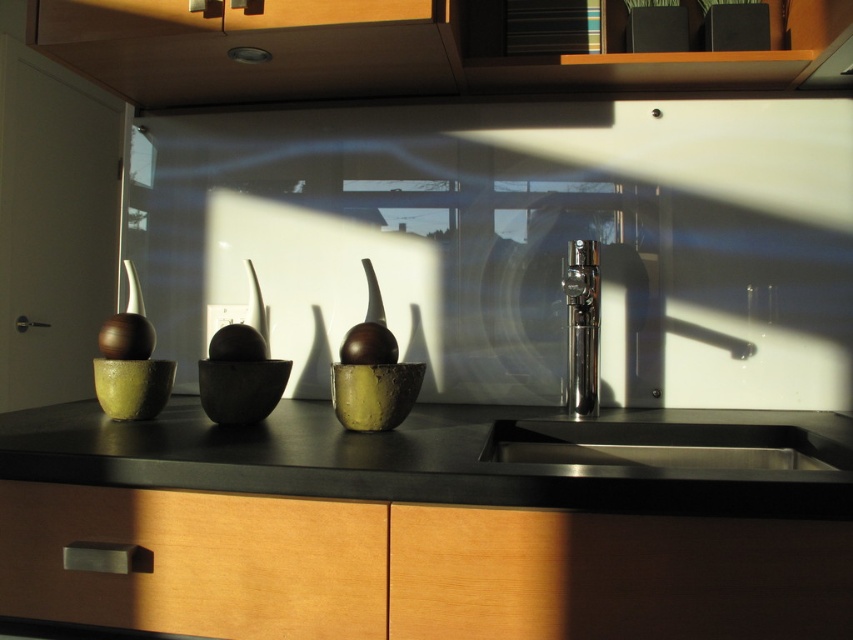
The height and width of the screenshot is (640, 853). Describe the element at coordinates (409, 532) in the screenshot. I see `black matte countertop at center` at that location.

Is black matte countertop at center smaller than stainless steel sink at lower center?

No, black matte countertop at center is not smaller than stainless steel sink at lower center.

Is point (374, 460) closer to camera compared to point (799, 433)?

Yes, point (374, 460) is in front of point (799, 433).

In order to click on black matte countertop at center in this screenshot , I will do `click(409, 532)`.

From the picture: Measure the distance between stainless steel sink at lower center and polished chrome faucet at center.

They are 7.43 inches apart.

What do you see at coordinates (664, 445) in the screenshot? This screenshot has height=640, width=853. I see `stainless steel sink at lower center` at bounding box center [664, 445].

Who is more distant from viewer, [614,440] or [576,336]?

Answer: The point [576,336] is more distant.

I want to click on stainless steel sink at lower center, so [664, 445].

Does point (305, 518) lie in front of point (589, 307)?

Yes.

Is black matte countertop at center in front of polished chrome faucet at center?

Yes, black matte countertop at center is in front of polished chrome faucet at center.

Does point (721, 595) come closer to viewer compared to point (589, 259)?

Yes.

Where is `black matte countertop at center`? The width and height of the screenshot is (853, 640). black matte countertop at center is located at coordinates (409, 532).